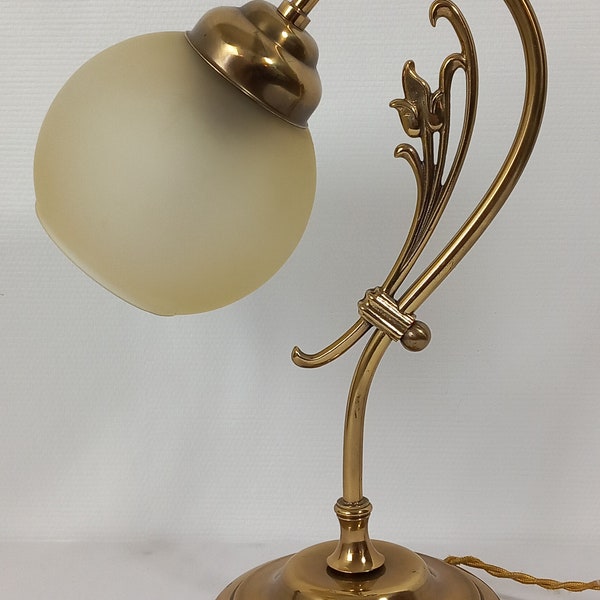
This screenshot has width=600, height=600. In order to click on light shade in this screenshot , I will do `click(170, 168)`.